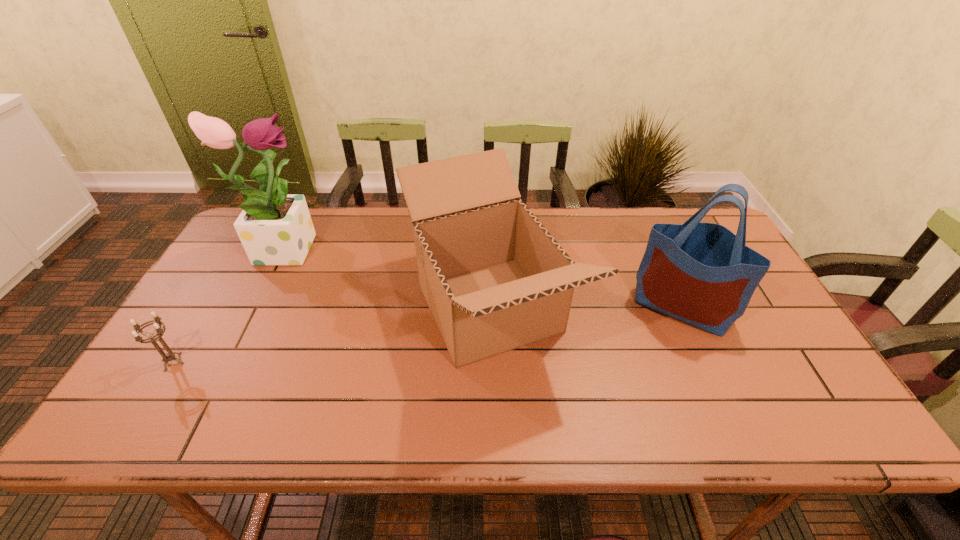
Locate an element on the screen. empty space that is in between the second object from right to left and the handbag is located at coordinates point(586,308).

Where is `empty space between the second object from right to left and the tallest object`? empty space between the second object from right to left and the tallest object is located at coordinates (387, 278).

I want to click on free spot between the candle holder and the rightmost object, so click(x=427, y=334).

You are a GUI agent. You are given a task and a screenshot of the screen. Output one action in this format:
    pyautogui.click(x=<x>, y=<y>)
    Task: Click on the unoccupied position between the second object from right to left and the handbag
    
    Given the screenshot: What is the action you would take?
    pyautogui.click(x=586, y=308)

Find the location of a particular element. free spot between the shortest object and the handbag is located at coordinates (427, 334).

Where is `free spot between the second object from right to left and the tallest object`? This screenshot has height=540, width=960. free spot between the second object from right to left and the tallest object is located at coordinates (387, 278).

The height and width of the screenshot is (540, 960). I want to click on free space between the tallest object and the shortest object, so click(x=228, y=304).

Locate an element on the screen. This screenshot has height=540, width=960. object that is the second closest to the flower arrangement is located at coordinates (494, 278).

You are a GUI agent. You are given a task and a screenshot of the screen. Output one action in this format:
    pyautogui.click(x=<x>, y=<y>)
    Task: Click on the object identified as the closest to the second object from right to left
    Image resolution: width=960 pixels, height=540 pixels.
    Given the screenshot: What is the action you would take?
    pyautogui.click(x=703, y=274)

Locate an element on the screen. vacant space that satisfies the following two spatial constraints: 1. on the back side of the handbag; 2. on the left side of the candle holder is located at coordinates (207, 307).